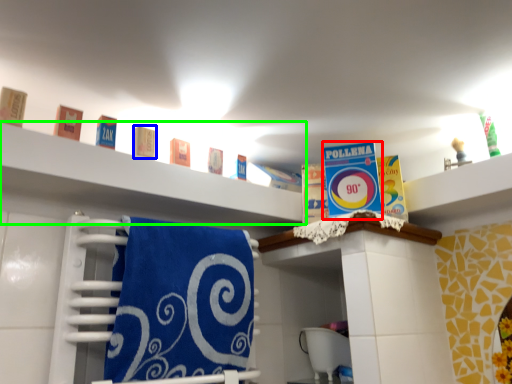
Question: Which is farther away from product (highlighted by a red box)? product (highlighted by a blue box) or shelf (highlighted by a green box)?

Choices:
 (A) product
 (B) shelf

Answer: (A)